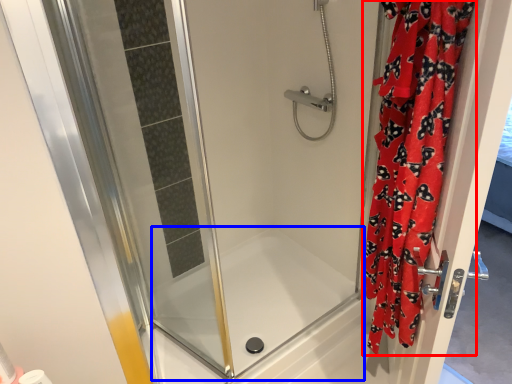
Question: Which object appears farthest to the camera in this image, curtain (highlighted by a red box) or bath (highlighted by a blue box)?

Choices:
 (A) curtain
 (B) bath

Answer: (B)